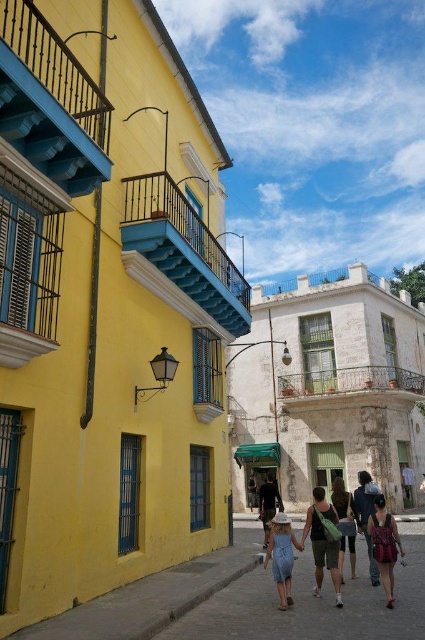
Is matte green bag at center to the right of denim dress at center from the viewer's perspective?

Indeed, matte green bag at center is positioned on the right side of denim dress at center.

Who is higher up, matte green bag at center or denim dress at center?

A: matte green bag at center is above.

At what (x,y) coordinates should I click in order to perform the action: click on matte green bag at center. Please return your answer as a coordinate pair (x, y). Image resolution: width=425 pixels, height=640 pixels. Looking at the image, I should click on (323, 541).

Which is more to the left, denim dress at center or matte black dress at center?

denim dress at center is more to the left.

Is denim dress at center thinner than matte black dress at center?

Yes.

Is point (291, 557) positioned after point (331, 497)?

No, (291, 557) is closer to viewer.

In order to click on denim dress at center in this screenshot , I will do `click(282, 556)`.

Between matte black dress at center and light brown leather bag at center, which one is positioned lower?

light brown leather bag at center is below.

Who is more distant from viewer, [342,552] or [252,509]?

The point [252,509] is behind.

The height and width of the screenshot is (640, 425). I want to click on matte black dress at center, so click(345, 524).